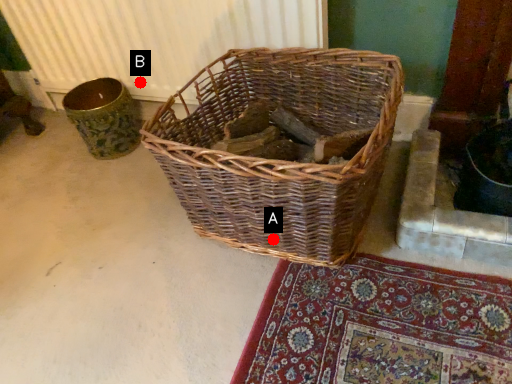
Question: Two points are circled on the image, labeled by A and B beside each circle. Which of the following is the farthest from the observer?

Choices:
 (A) A is further
 (B) B is further

Answer: (B)